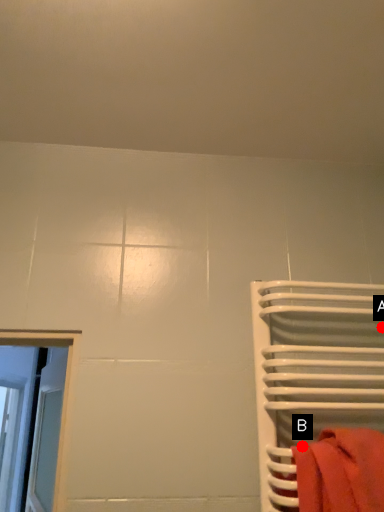
Question: Two points are circled on the image, labeled by A and B beside each circle. Which of the following is the closest to the observer?

Choices:
 (A) A is closer
 (B) B is closer

Answer: (B)